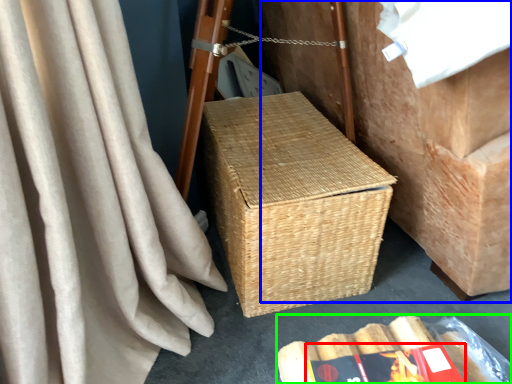
Question: Based on their relative distances, which object is nearer to paperback book (highlighted by a red box)? Choose from furniture (highlighted by a blue box) and storage box (highlighted by a green box).

Choices:
 (A) furniture
 (B) storage box

Answer: (B)